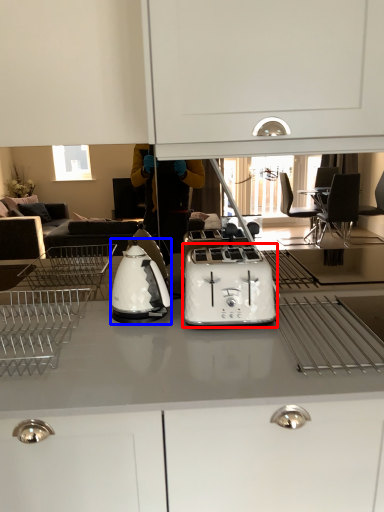
Question: Which of the following is the farthest to the observer, toaster (highlighted by a red box) or kitchen appliance (highlighted by a blue box)?

Choices:
 (A) toaster
 (B) kitchen appliance

Answer: (B)